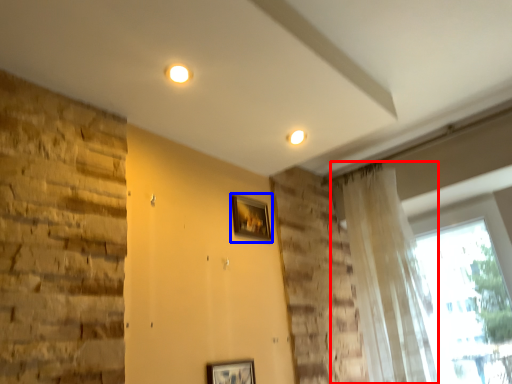
Question: Among these objects, which one is farthest to the camera, curtain (highlighted by a red box) or picture frame (highlighted by a blue box)?

Choices:
 (A) curtain
 (B) picture frame

Answer: (B)